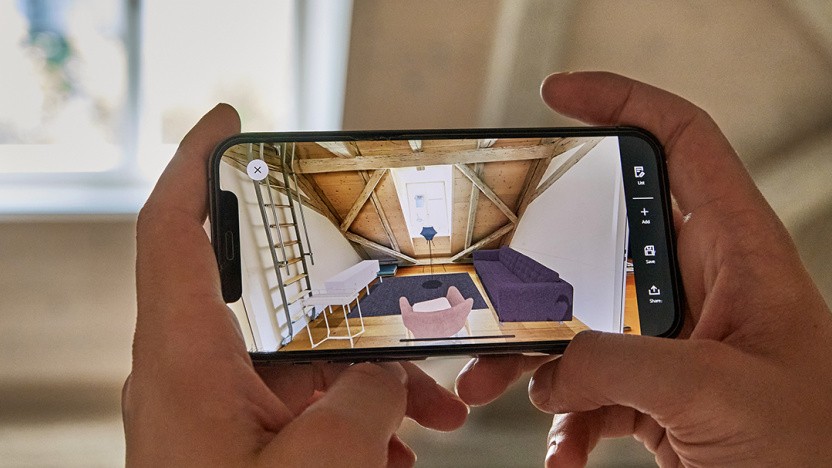
Where is `picture of pink chair on cell phone`? This screenshot has width=832, height=468. picture of pink chair on cell phone is located at coordinates (438, 321).